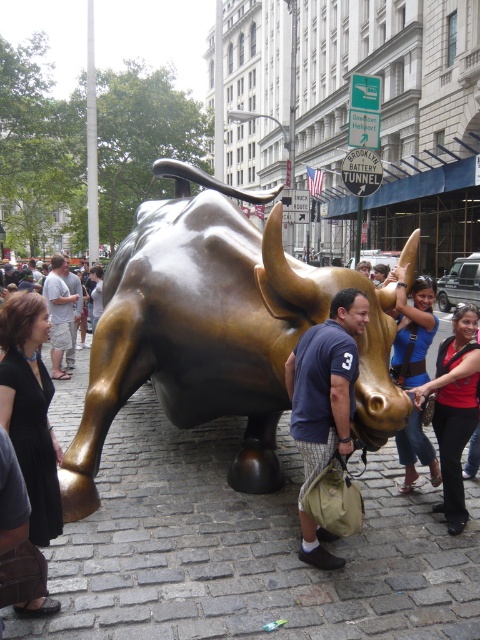
Question: Does matte gold statue at center have a greater width compared to bronze statue at center?

Choices:
 (A) yes
 (B) no

Answer: (B)

Question: Can you confirm if gold polished metal bull at center is positioned to the left of bronze statue at center?

Choices:
 (A) yes
 (B) no

Answer: (B)

Question: Which point appears closest to the camera in this image?

Choices:
 (A) (49, 273)
 (B) (404, 387)

Answer: (B)

Question: In this image, where is blue t-shirt at center located relative to bronze statue at center?

Choices:
 (A) below
 (B) above

Answer: (A)

Question: Which point is farther from the camera taking this photo?

Choices:
 (A) click(297, 440)
 (B) click(123, 244)
 (C) click(66, 355)
 (D) click(427, 307)

Answer: (C)

Question: Which object is closer to the camera taking this photo?

Choices:
 (A) red fabric shirt at center
 (B) blue fabric shirt at center
 (C) blue t-shirt at center

Answer: (C)